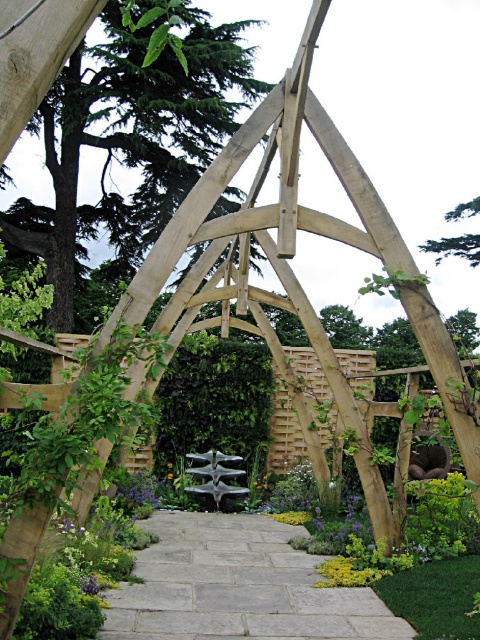
Question: Which point appears farthest from the camera in this image?

Choices:
 (A) (241, 636)
 (B) (168, 477)

Answer: (B)

Question: Can you confirm if gray stone path at center is wider than yellow matte flower at center?

Choices:
 (A) yes
 (B) no

Answer: (A)

Question: Does gray stone path at center appear on the left side of yellow matte flower at center?

Choices:
 (A) no
 (B) yes

Answer: (A)

Question: Is gray stone path at center above yellow matte flower at center?

Choices:
 (A) yes
 (B) no

Answer: (A)